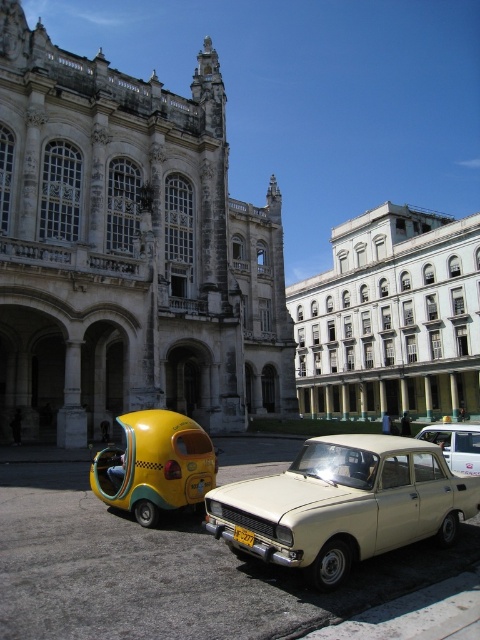
You are standing in the city square and want to take a photo of the grand building on the left. Where should you position yourself to ensure the point at coordinates (129, 250) on the building is visible in your photo?

You should position yourself so that the camera is facing the white stone building at left, ensuring the point at coordinates (129, 250) is within the frame. Since the point is on the white stone building at left, aligning the camera towards that building will capture it.

Looking at this image, you are a photographer planning to capture both the beige matte sedan at center and the yellow matte taxi at lower left in a single frame. Given their heights, which vehicle should be placed closer to the camera to ensure both are fully visible without cropping?

The beige matte sedan at center is shorter than the yellow matte taxi at lower left. To ensure both are fully visible, position the beige matte sedan at center closer to the camera so its full height can be captured while the taller yellow matte taxi at lower left remains in the frame.